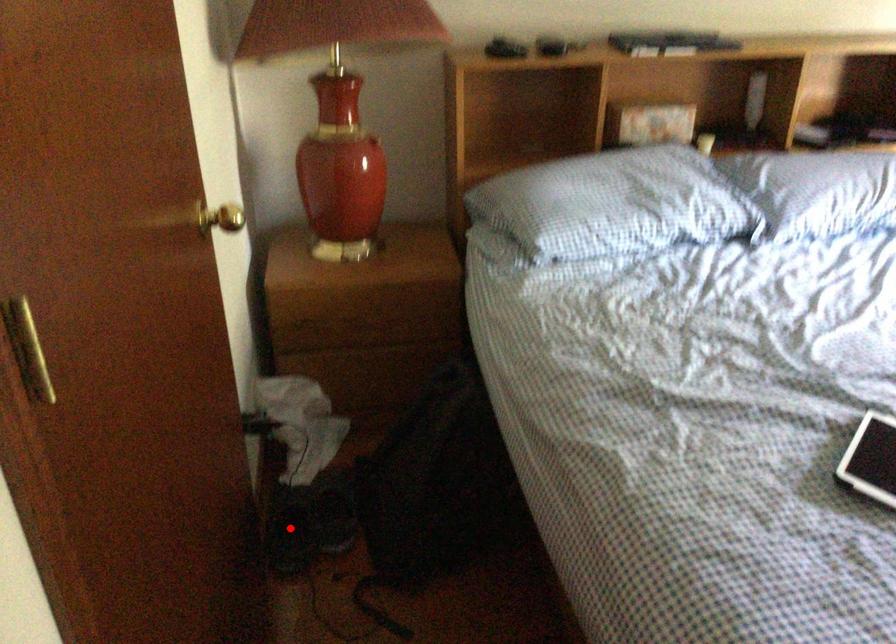
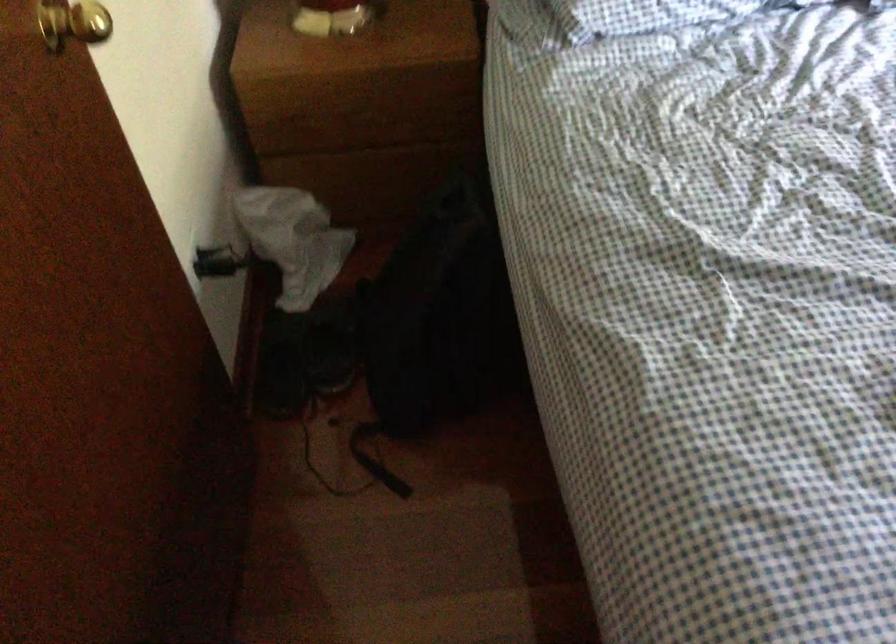
The point at the highlighted location is marked in the first image. Where is the corresponding point in the second image?

(282, 363)